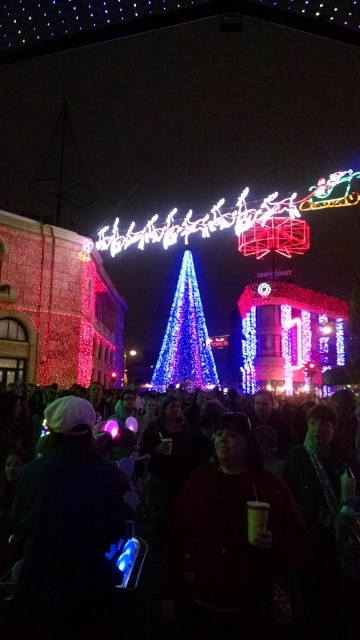
You are a photographer trying to capture the festive atmosphere of the event. You notice the dark matte sweatshirt at center and the blue led lights at center in your frame. Which object should you focus on if you want to highlight something that takes up more visual space in the photo?

The dark matte sweatshirt at center has a larger size compared to the blue led lights at center, so focusing on it would highlight the object that takes up more visual space in the photo.

You are a delivery person with a cart that is 1.5 meters wide. You need to navigate through the scene to reach the Christmas tree in the background. Is there enough space between the black fabric crowd at lower center and the dark matte sweatshirt at center for your cart to pass through?

The space between the black fabric crowd at lower center and the dark matte sweatshirt at center is 5.47 meters. Since your cart is only 1.5 meters wide, there is ample space for the cart to pass through safely.